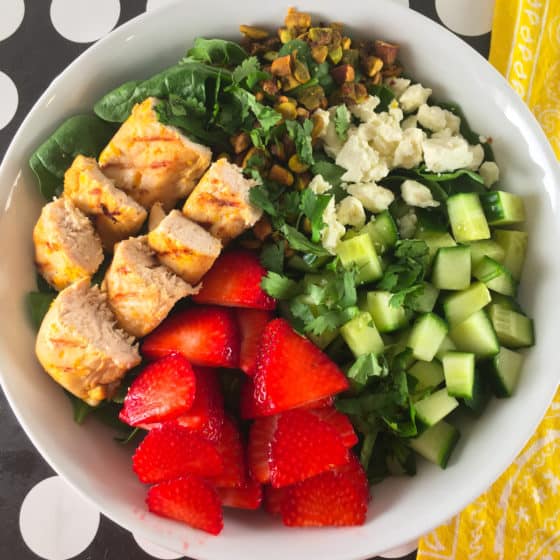
Find the location of a particular element. Image resolution: width=560 pixels, height=560 pixels. ceramic bowl is located at coordinates (452, 496).